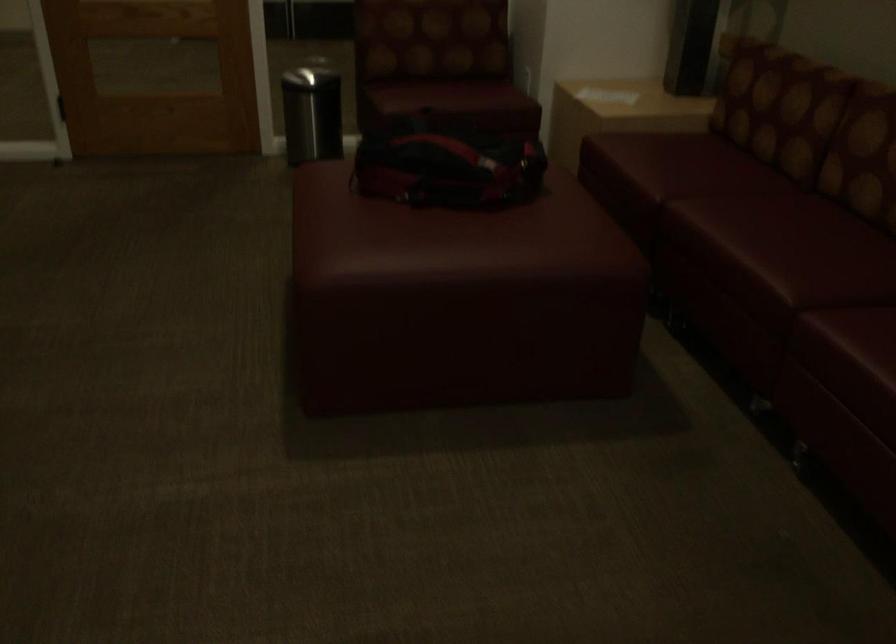
Where is `red chair sitting surface`? This screenshot has width=896, height=644. red chair sitting surface is located at coordinates (448, 96).